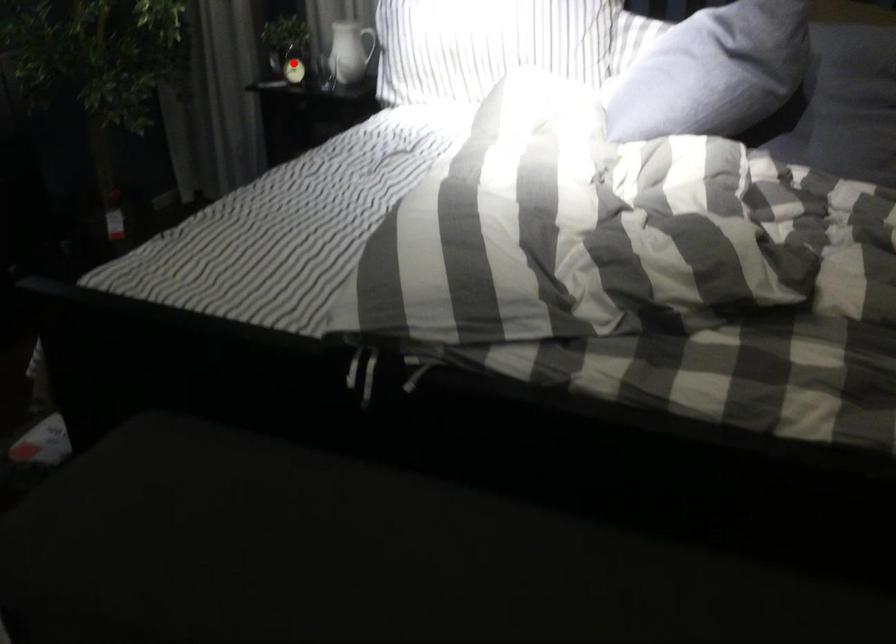
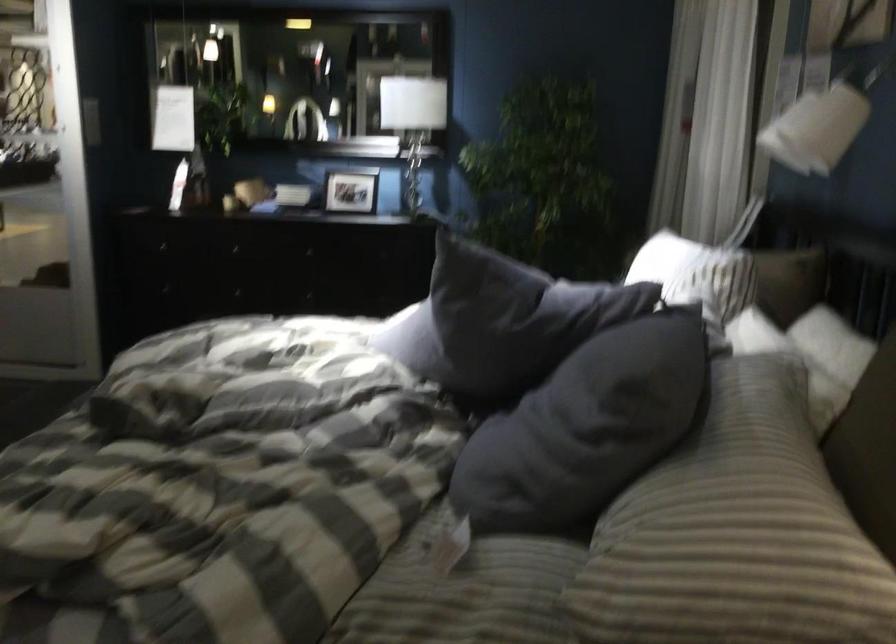
Question: I am providing you with two images of the same scene from different viewpoints. A red point is marked on the first image. At the location where the point appears in image 1, is it still visible in image 2?

Choices:
 (A) Yes
 (B) No

Answer: (B)